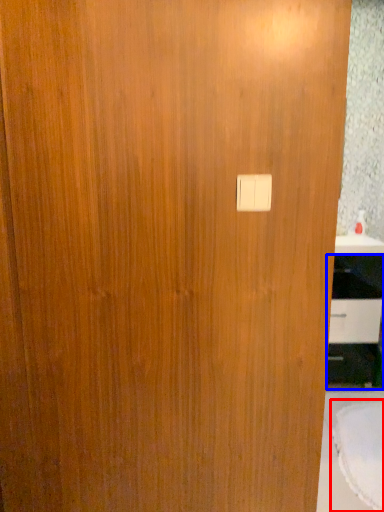
Question: Among these objects, which one is farthest to the camera, round table (highlighted by a red box) or cabinetry (highlighted by a blue box)?

Choices:
 (A) round table
 (B) cabinetry

Answer: (B)